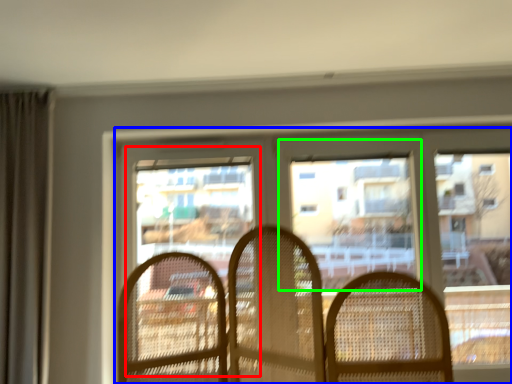
Question: Which object is the farthest from screen door (highlighted by a red box)? Choose among these: window (highlighted by a blue box) or window screen (highlighted by a green box).

Choices:
 (A) window
 (B) window screen

Answer: (B)